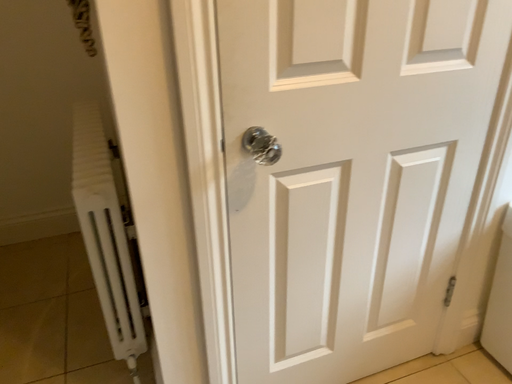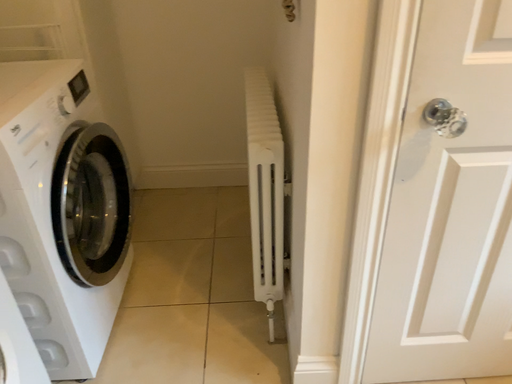
Question: Which way did the camera rotate in the video?

Choices:
 (A) rotated right
 (B) rotated left

Answer: (B)